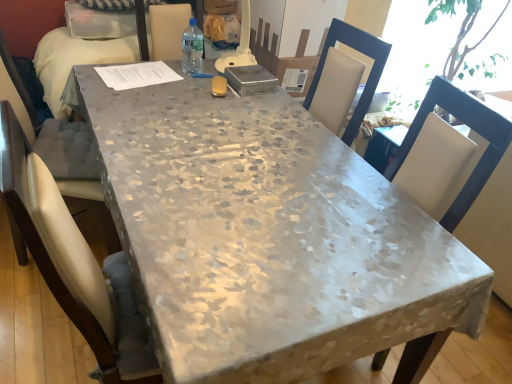
Question: From a real-world perspective, is white fabric chair at right on clear plastic bottle at center?

Choices:
 (A) yes
 (B) no

Answer: (B)

Question: Are white fabric chair at right and clear plastic bottle at center making contact?

Choices:
 (A) yes
 (B) no

Answer: (B)

Question: Can you confirm if white fabric chair at right is thinner than clear plastic bottle at center?

Choices:
 (A) yes
 (B) no

Answer: (B)

Question: Does white fabric chair at right have a greater height compared to clear plastic bottle at center?

Choices:
 (A) no
 (B) yes

Answer: (B)

Question: From a real-world perspective, does white fabric chair at right sit lower than clear plastic bottle at center?

Choices:
 (A) no
 (B) yes

Answer: (B)

Question: Is clear plastic bottle at center to the left or to the right of floral-patterned fabric table at center in the image?

Choices:
 (A) right
 (B) left

Answer: (B)

Question: Is clear plastic bottle at center spatially inside floral-patterned fabric table at center, or outside of it?

Choices:
 (A) outside
 (B) inside

Answer: (A)

Question: Looking at the image, does clear plastic bottle at center seem bigger or smaller compared to floral-patterned fabric table at center?

Choices:
 (A) big
 (B) small

Answer: (B)

Question: Considering the positions of clear plastic bottle at center and floral-patterned fabric table at center in the image, is clear plastic bottle at center wider or thinner than floral-patterned fabric table at center?

Choices:
 (A) wide
 (B) thin

Answer: (B)

Question: Considering their positions, is clear plastic bottle at center located in front of or behind white fabric chair at right?

Choices:
 (A) front
 (B) behind

Answer: (B)

Question: Does point (184, 44) appear closer or farther from the camera than point (437, 77)?

Choices:
 (A) farther
 (B) closer

Answer: (A)

Question: From a real-world perspective, relative to white fabric chair at right, is clear plastic bottle at center vertically above or below?

Choices:
 (A) above
 (B) below

Answer: (A)

Question: Is clear plastic bottle at center wider or thinner than white fabric chair at right?

Choices:
 (A) wide
 (B) thin

Answer: (B)

Question: Considering the positions of floral-patterned fabric table at center and white fabric chair at right in the image, is floral-patterned fabric table at center taller or shorter than white fabric chair at right?

Choices:
 (A) short
 (B) tall

Answer: (A)

Question: Is point (217, 264) positioned closer to the camera than point (486, 114)?

Choices:
 (A) farther
 (B) closer

Answer: (B)